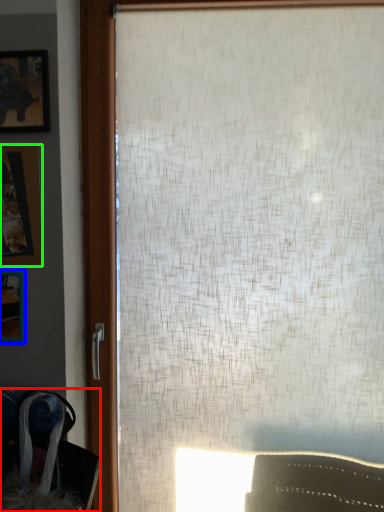
Question: Which is farther away from swivel chair (highlighted by a red box)? picture frame (highlighted by a blue box) or picture frame (highlighted by a green box)?

Choices:
 (A) picture frame
 (B) picture frame

Answer: (B)